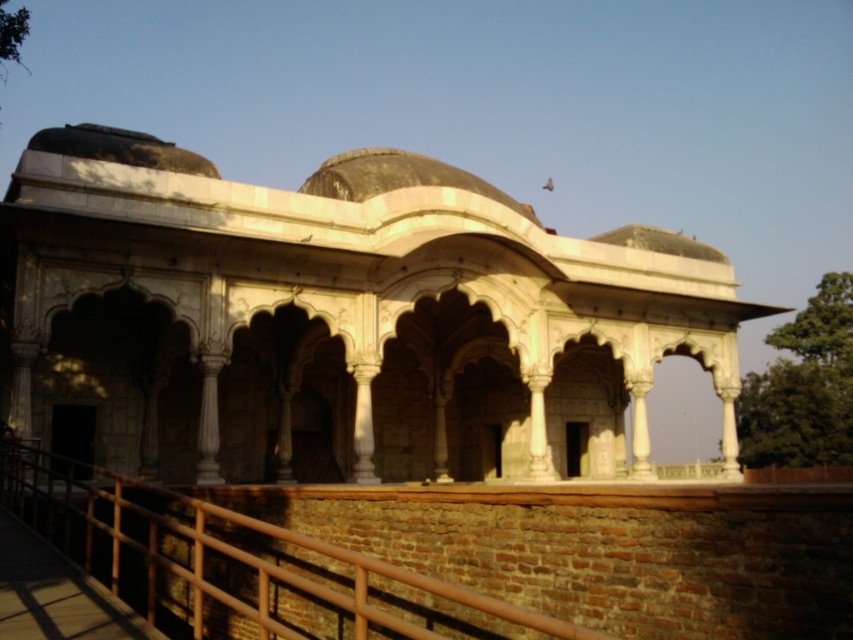
You are an architect visiting this historical site. You need to determine which object occupies more space in the image. Which one is bigger between the white marble palace at center and the brown wood railing at lower center?

The white marble palace at center has a larger size compared to the brown wood railing at lower center, so the white marble palace at center occupies more space in the image.

You are standing at the entrance of the historical structure and want to locate the white marble palace at center. According to the coordinates provided, where should you look to find it?

The white marble palace at center is located at the coordinates point (337, 321), so you should look towards the center of the structure to find it.

You are standing at the entrance of the historical Mughal structure and notice two points marked in the scene. The first point is at coordinates point (544,400) and the second is at point (96,509). Which point is closer to your current position?

Point (96,509) is closer to your current position because it is in front of point (544,400).